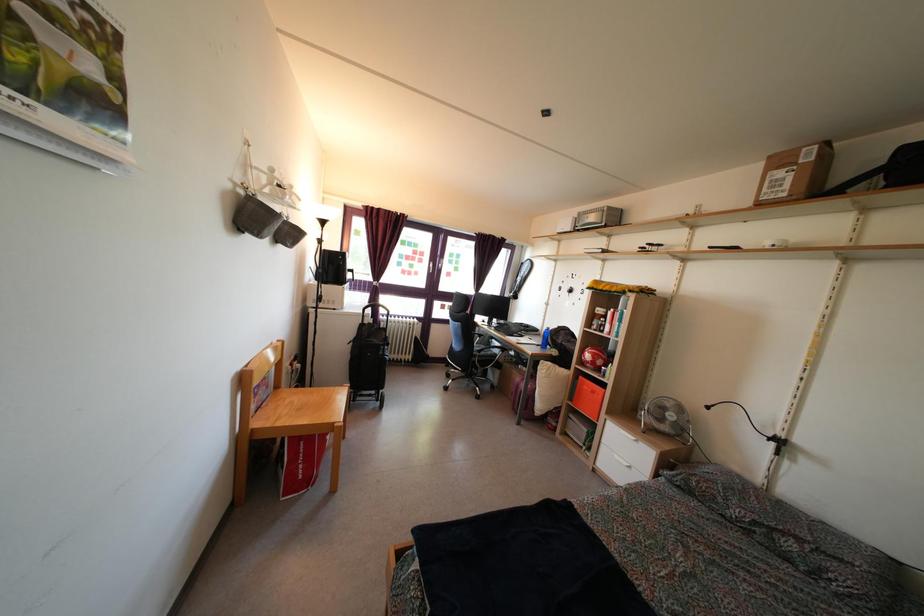
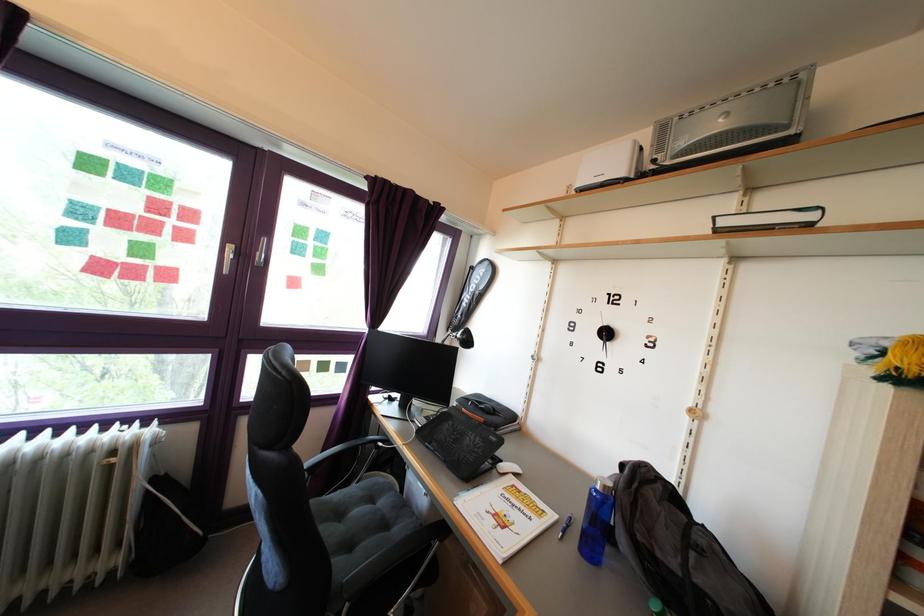
In the second image, find the point that corresponds to point (551, 337) in the first image.

(609, 496)